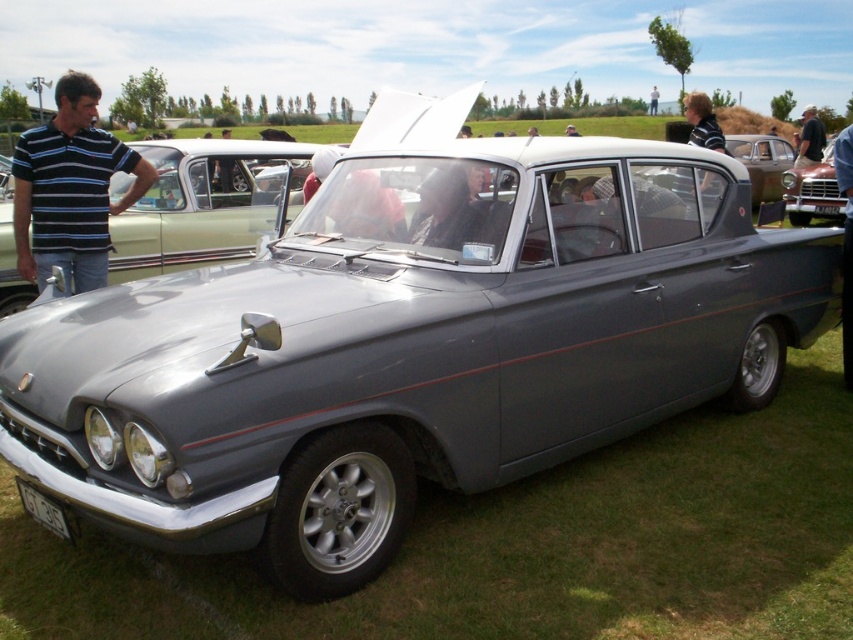
You are a photographer wanting to capture the metallic red car at center and the blue striped polo shirt at left in the same frame. Based on their positions, which object is located more to the left side of the image?

The blue striped polo shirt at left is positioned to the left of the metallic red car at center, so it is more to the left side of the image.

You are standing 5 meters away from a classic car parked on a grassy field. You want to take a closer look at the engine compartment, which is located at point (94, 93). Can you safely approach the car without getting too close to the engine compartment?

The distance of point (94, 93) from the camera is 4.80 meters. Since you are currently 5 meters away from the car, moving closer to the engine compartment would bring you to 4.80 meters, which is still a safe distance. However, ensure you maintain a reasonable distance to avoid any potential hazards.